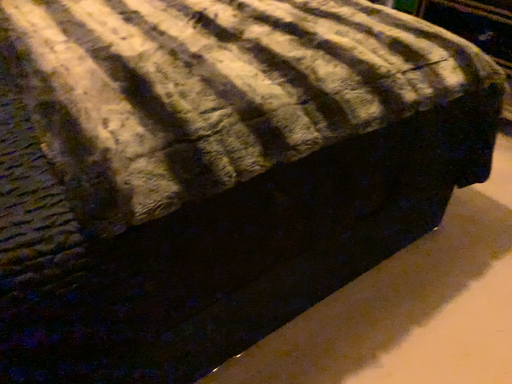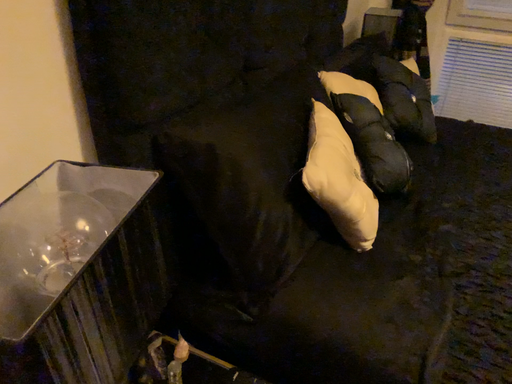
Question: Which way did the camera rotate in the video?

Choices:
 (A) rotated right
 (B) rotated left

Answer: (B)